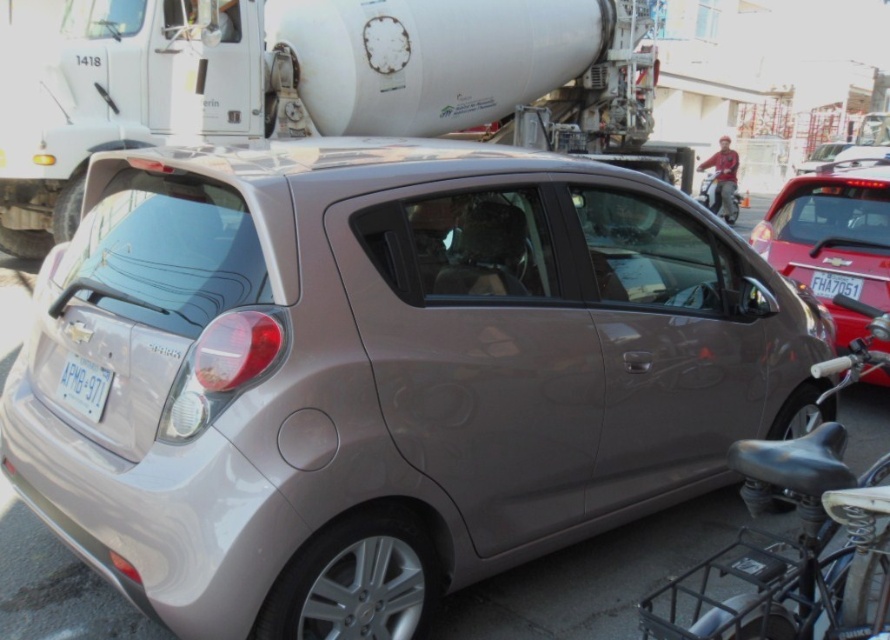
Question: Observing the image, what is the correct spatial positioning of metallic red car at right in reference to white plastic license plate at center?

Choices:
 (A) left
 (B) right

Answer: (B)

Question: Which point is farther to the camera?

Choices:
 (A) white plastic license plate at lower left
 (B) white concrete mixer at upper center
 (C) metallic red car at right
 (D) satin metallic hatchback at center

Answer: (B)

Question: Is white concrete mixer at upper center thinner than satin gold hatchback at center?

Choices:
 (A) yes
 (B) no

Answer: (B)

Question: Can you confirm if satin metallic hatchback at center is thinner than satin gold hatchback at center?

Choices:
 (A) yes
 (B) no

Answer: (A)

Question: Which of these objects is positioned closest to the satin gold hatchback at center?

Choices:
 (A) white plastic license plate at lower left
 (B) satin metallic hatchback at center
 (C) white concrete mixer at upper center

Answer: (C)

Question: Which point is farther from the camera taking this photo?

Choices:
 (A) (854, 288)
 (B) (826, 157)
 (C) (871, 189)

Answer: (B)